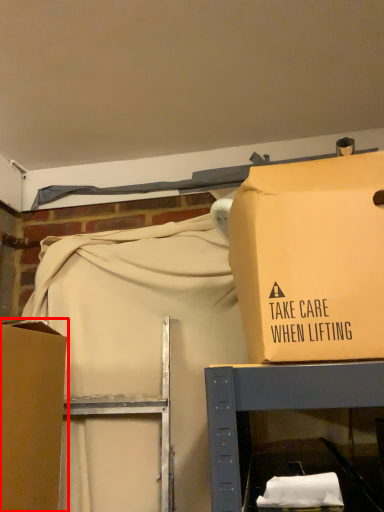
Question: From the image, what is the correct spatial relationship of box (annotated by the red box) in relation to box?

Choices:
 (A) left
 (B) right

Answer: (A)